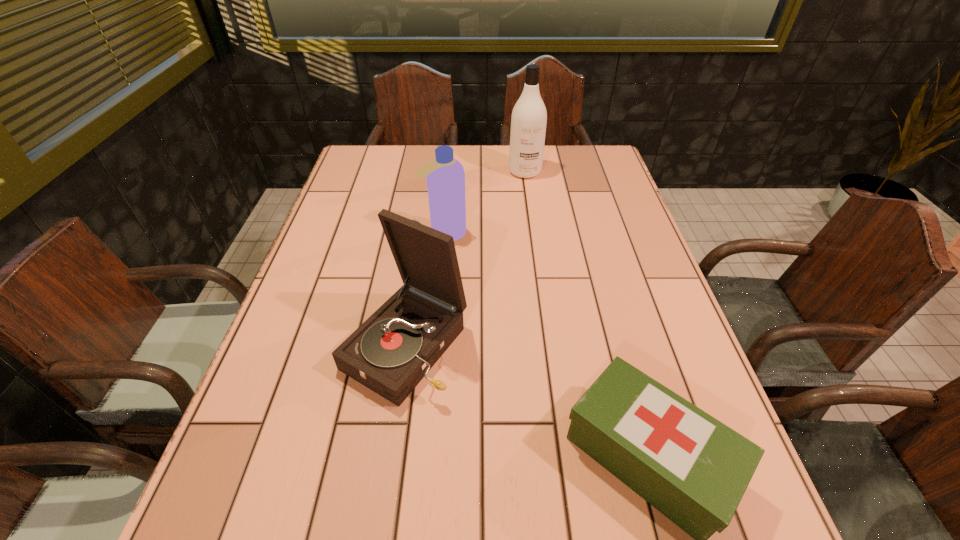
The image size is (960, 540). I want to click on the farther shampoo, so click(529, 116).

Locate an element on the screen. the farthest object is located at coordinates (529, 116).

Where is `phonograph record`? This screenshot has width=960, height=540. phonograph record is located at coordinates point(390,353).

You are a GUI agent. You are given a task and a screenshot of the screen. Output one action in this format:
    pyautogui.click(x=<x>, y=<y>)
    Task: Click on the nearer shampoo
    This screenshot has width=960, height=540.
    Given the screenshot: What is the action you would take?
    pyautogui.click(x=445, y=175)

The image size is (960, 540). I want to click on the left shampoo, so click(x=445, y=175).

Where is `vacant region located 0.340m on the front-facing side of the farther shampoo`? The height and width of the screenshot is (540, 960). vacant region located 0.340m on the front-facing side of the farther shampoo is located at coordinates (536, 251).

The image size is (960, 540). Identify the location of free region located on the back of the phonograph record. (422, 235).

Identify the location of free space located 0.150m on the left of the nearer shampoo. (368, 233).

What are the coordinates of `object present at the far edge` in the screenshot? It's located at (529, 116).

Where is `object at the left edge`? The image size is (960, 540). object at the left edge is located at coordinates (390, 353).